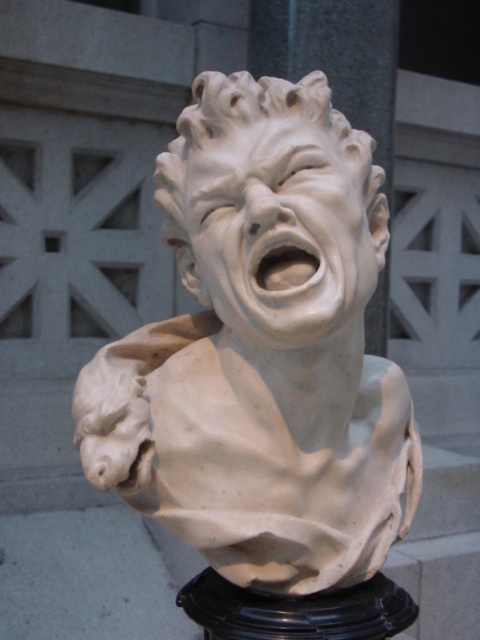
Question: Does white marble bust at center appear under white marble face at center?

Choices:
 (A) no
 (B) yes

Answer: (B)

Question: Considering the relative positions of white marble bust at center and white marble face at center in the image provided, where is white marble bust at center located with respect to white marble face at center?

Choices:
 (A) left
 (B) right

Answer: (A)

Question: Which of the following is the farthest from the observer?

Choices:
 (A) white marble face at center
 (B) white marble bust at center

Answer: (A)

Question: Which point appears closest to the camera in this image?

Choices:
 (A) (384, 515)
 (B) (184, 193)

Answer: (B)

Question: Which object is farther from the camera taking this photo?

Choices:
 (A) white marble bust at center
 (B) white marble face at center

Answer: (B)

Question: Is white marble bust at center positioned in front of white marble face at center?

Choices:
 (A) no
 (B) yes

Answer: (B)